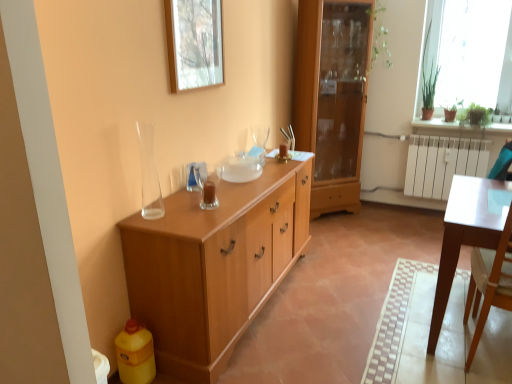
This screenshot has width=512, height=384. In order to click on free space in front of transparent glass vase at left in this screenshot , I will do `click(152, 220)`.